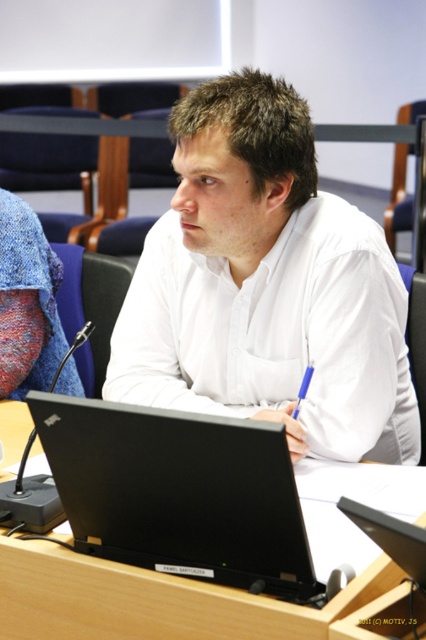
Based on the photo, you are a photographer trying to capture a closeup of the man while avoiding the microphone. The microphone is located at point (163, 227) and the man is at point (374, 566). Which point should you focus on to get the man in focus without the microphone being in the foreground?

You should focus on point (374, 566) because it is closer to the camera than point (163, 227), allowing the man to be in focus while the microphone is farther away and less likely to obstruct the shot.

You are an event organizer setting up a conference room. You have a black plastic table at center and a black matte laptop at center. Where should you place the laptop to ensure it is properly positioned on the table?

The black plastic table at center is positioned under black matte laptop at center, so the laptop should be placed on top of the black plastic table at center to ensure proper positioning.

You are a photographer setting up for a professional headshot. The subject is wearing a white smooth shirt at center and has a black matte laptop at center on the desk. To ensure the shirt doesn not get accidentally captured in the photo, where should you position the camera relative to the laptop?

The white smooth shirt at center is positioned over the black matte laptop at center, so positioning the camera above the laptop would avoid capturing the shirt in the shot.